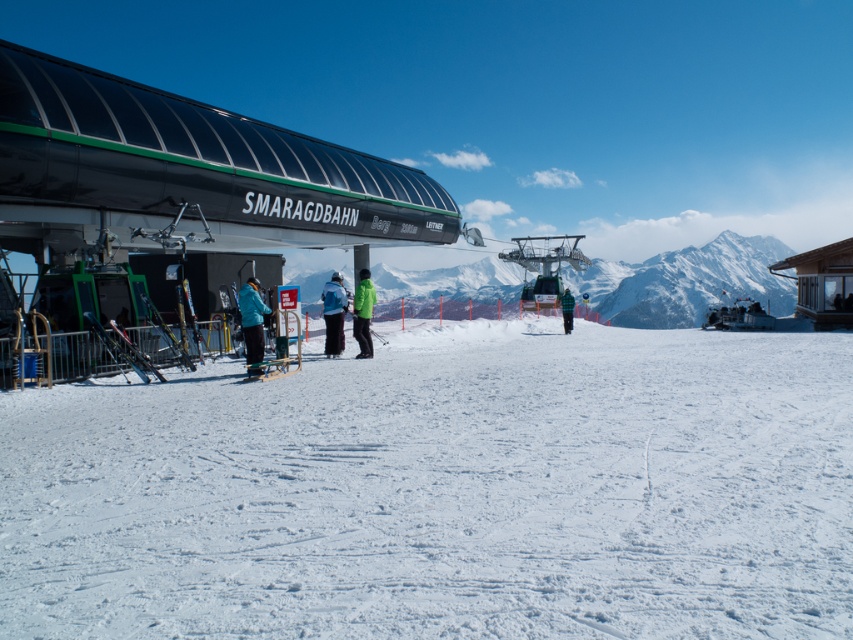
You are a skier who just arrived at the SMARAGDBAHN ski lift station. You see a blue fabric jacket at center and a metallic silver ski at lower left. Which object is closer to the left edge of the image?

The metallic silver ski at lower left is closer to the left edge of the image because the blue fabric jacket at center is to the right of it.

Looking at this image, you are a skier planning to take the SMARAGDBAHN lift to the top of the mountain. You notice the white snow at center and the metallic skis at lower left. Which object is bigger in size?

The white snow at center has a larger size compared to the metallic skis at lower left, so the white snow at center is bigger in size.